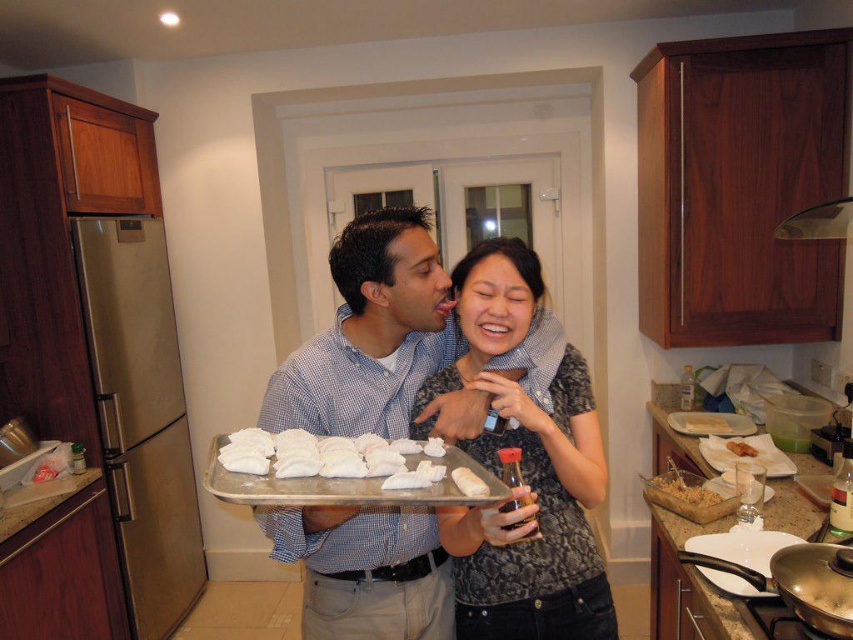
Question: Which of the following is the farthest from the observer?

Choices:
 (A) white matte bread at center
 (B) white fluffy pastry at center
 (C) white matte tray at center

Answer: (C)

Question: Does yellow cardboard box at center appear on the right side of white fluffy pastry at center?

Choices:
 (A) no
 (B) yes

Answer: (B)

Question: Can you confirm if patterned fabric shirt at center is smaller than white fluffy pastry at center?

Choices:
 (A) yes
 (B) no

Answer: (B)

Question: Observing the image, what is the correct spatial positioning of patterned fabric shirt at center in reference to golden crispy rice at right?

Choices:
 (A) above
 (B) below

Answer: (A)

Question: Which point is closer to the camera taking this photo?

Choices:
 (A) (434, 573)
 (B) (497, 636)
 (C) (756, 449)
 (D) (370, 458)

Answer: (D)

Question: Which point is farther to the camera?

Choices:
 (A) patterned fabric shirt at center
 (B) yellow cardboard box at center
 (C) white matte bread at center

Answer: (B)